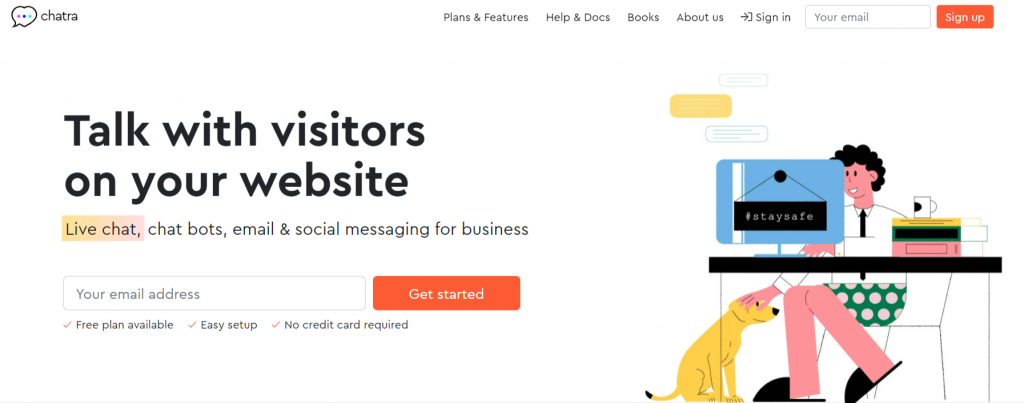
The height and width of the screenshot is (403, 1024). Identify the location of coffee mug. (918, 205).